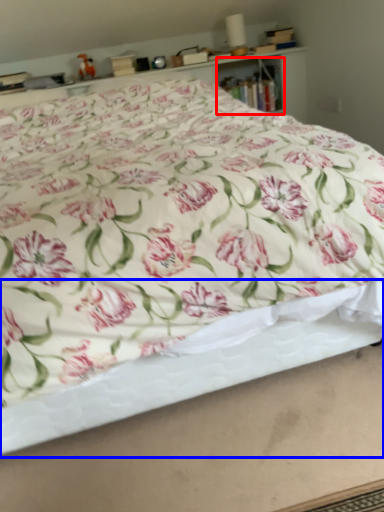
Question: Which object appears farthest to the camera in this image, cabinet (highlighted by a red box) or bed frame (highlighted by a blue box)?

Choices:
 (A) cabinet
 (B) bed frame

Answer: (A)